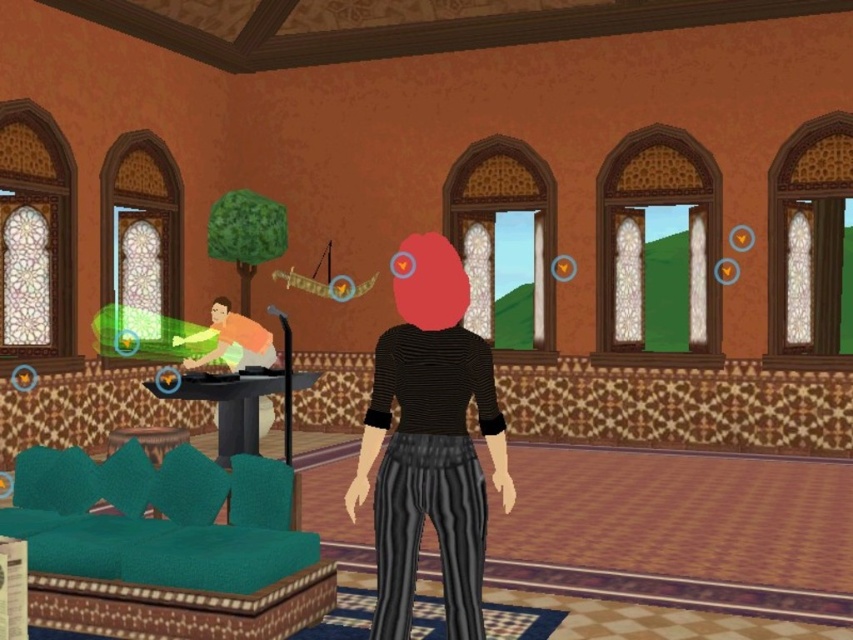
Is point (276, 618) positioned behind point (221, 397)?

No.

Can you confirm if teal fabric couch at lower left is positioned to the right of black glossy table at center?

Indeed, teal fabric couch at lower left is positioned on the right side of black glossy table at center.

Who is more forward, (270, 637) or (247, 451)?

Point (270, 637) is more forward.

Locate an element on the screen. Image resolution: width=853 pixels, height=640 pixels. teal fabric couch at lower left is located at coordinates (167, 545).

Can you confirm if black striped pants at center is positioned to the left of black glossy table at center?

No, black striped pants at center is not to the left of black glossy table at center.

Is black striped pants at center wider than black glossy table at center?

Incorrect, black striped pants at center's width does not surpass black glossy table at center's.

Image resolution: width=853 pixels, height=640 pixels. Find the location of `black striped pants at center`. black striped pants at center is located at coordinates (428, 442).

Where is `black striped pants at center`? This screenshot has width=853, height=640. black striped pants at center is located at coordinates (428, 442).

Is teal fabric couch at lower left smaller than black striped pants at center?

Incorrect, teal fabric couch at lower left is not smaller in size than black striped pants at center.

Which is more to the right, teal fabric couch at lower left or black striped pants at center?

From the viewer's perspective, black striped pants at center appears more on the right side.

Does point (251, 520) lie in front of point (404, 429)?

No, (251, 520) is behind (404, 429).

Where is `teal fabric couch at lower left`? The width and height of the screenshot is (853, 640). teal fabric couch at lower left is located at coordinates (167, 545).